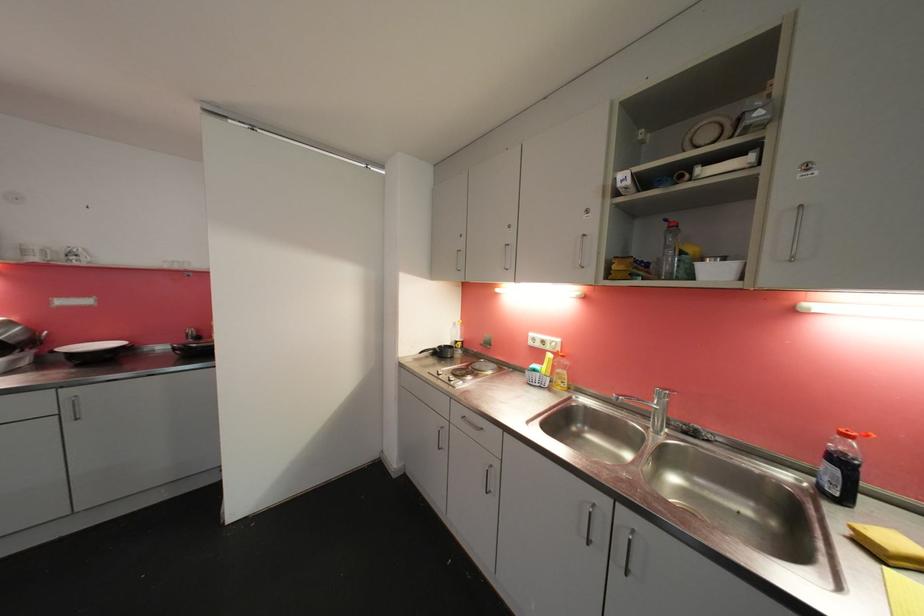
At what (x,y) coordinates should I click in order to perform the action: click on purple soap bottle. Please return your answer as a coordinate pair (x, y). Looking at the image, I should click on (841, 467).